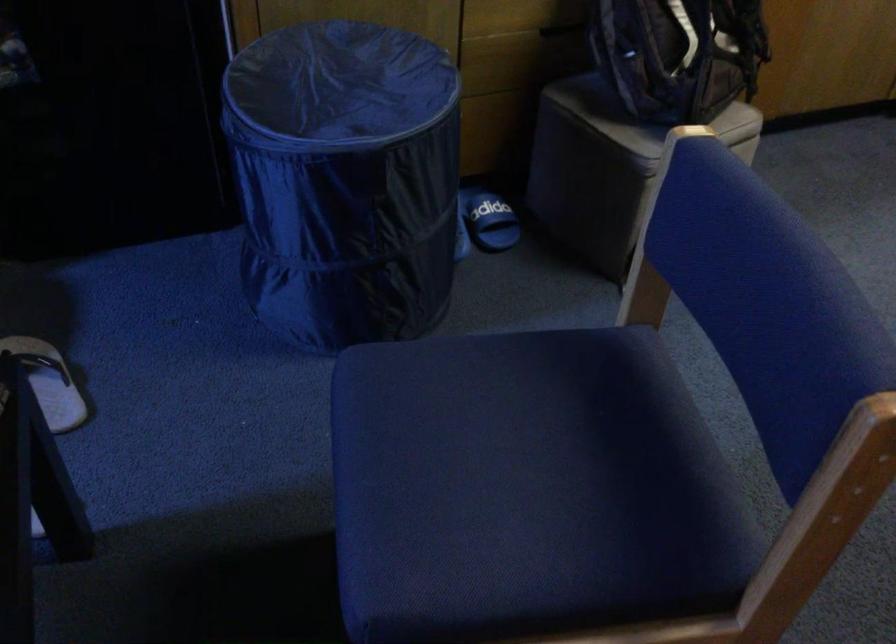
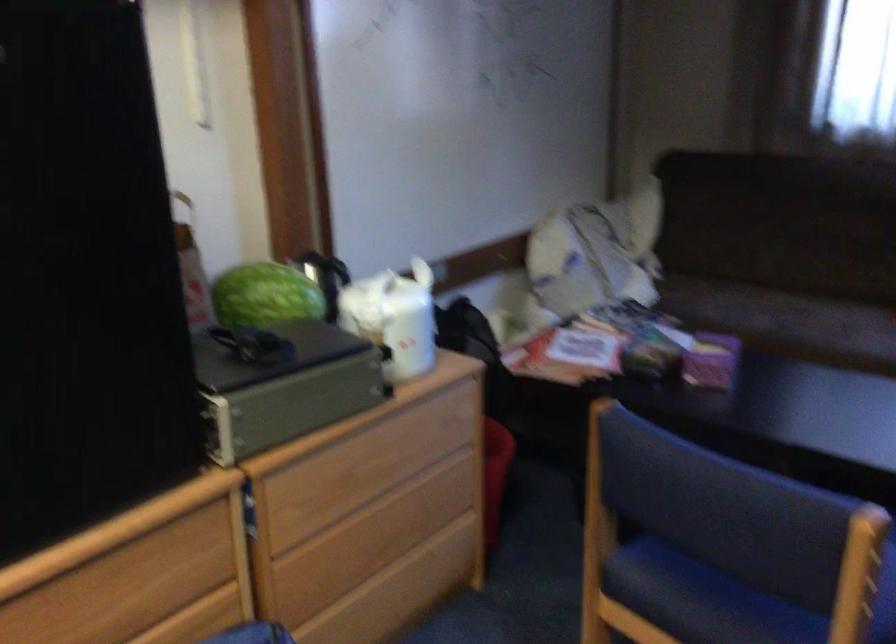
The point at (673, 450) is marked in the first image. Where is the corresponding point in the second image?

(702, 599)